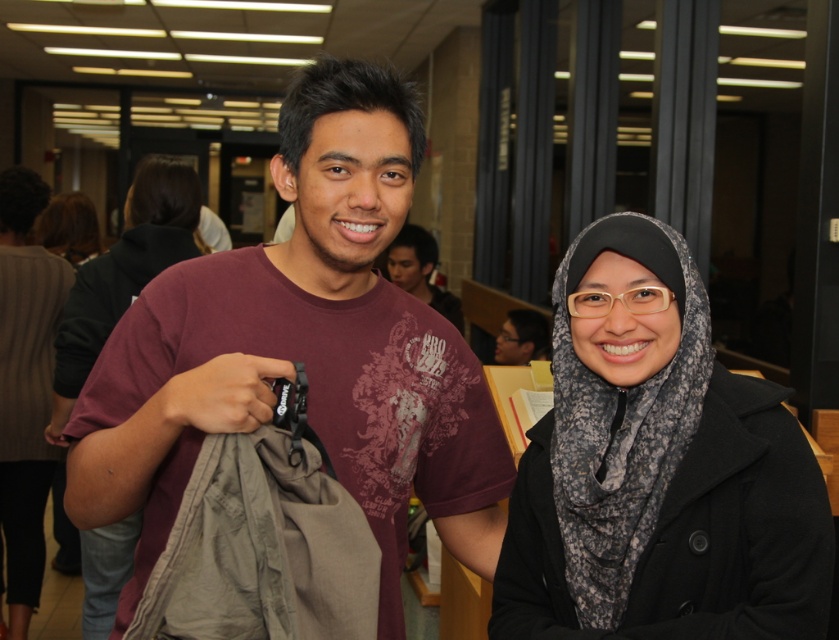
Is point (64, 406) positioned in front of point (402, 262)?

Yes.

Is point (107, 291) in front of point (457, 310)?

Yes, point (107, 291) is in front of point (457, 310).

Identify the location of matte black hijab at center. This screenshot has width=839, height=640. (123, 273).

Is point (243, 248) in front of point (821, 566)?

That is False.

Does point (108, 401) come behind point (572, 340)?

That is False.

Identify the location of maroon t-shirt at center. The width and height of the screenshot is (839, 640). (303, 352).

Who is taller, black textured hijab at center or matte maroon t-shirt at center?

Standing taller between the two is black textured hijab at center.

Which is above, black textured hijab at center or matte maroon t-shirt at center?

Positioned higher is matte maroon t-shirt at center.

Does point (728, 394) come behind point (420, 260)?

No, (728, 394) is closer to viewer.

At what (x,y) coordinates should I click in order to perform the action: click on black textured hijab at center. Please return your answer as a coordinate pair (x, y). Looking at the image, I should click on (657, 468).